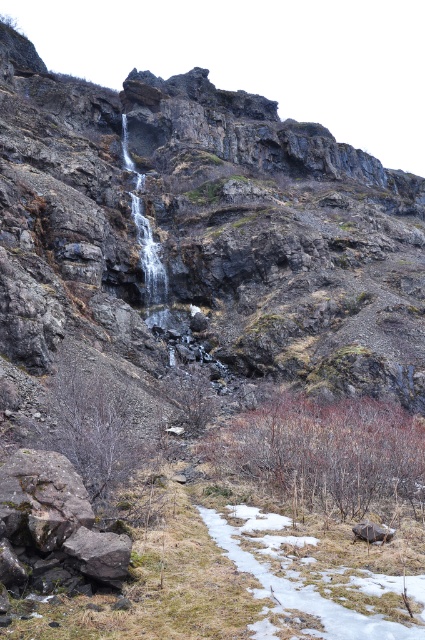
You are a hiker who has just arrived at the waterfall area. You see a rusty metallic rock at lower left and a smooth gray rock at lower right. Which rock is taller?

The rusty metallic rock at lower left is much taller than the smooth gray rock at lower right.

You are a hiker navigating the icy path in this rocky landscape. You notice the rusty metallic rock at lower left and the smooth gray rock at lower right. Which rock is located higher up on the path?

The rusty metallic rock at lower left is positioned over the smooth gray rock at lower right, meaning it is higher up on the path.

You are a hiker standing at the point labeled point (10, 545) and want to reach the point labeled point (367, 540). Given the rugged terrain and icy path, is the destination point closer to you or farther away?

The point labeled point (367, 540) is farther away from you than the point labeled point (10, 545), so the destination is farther away.